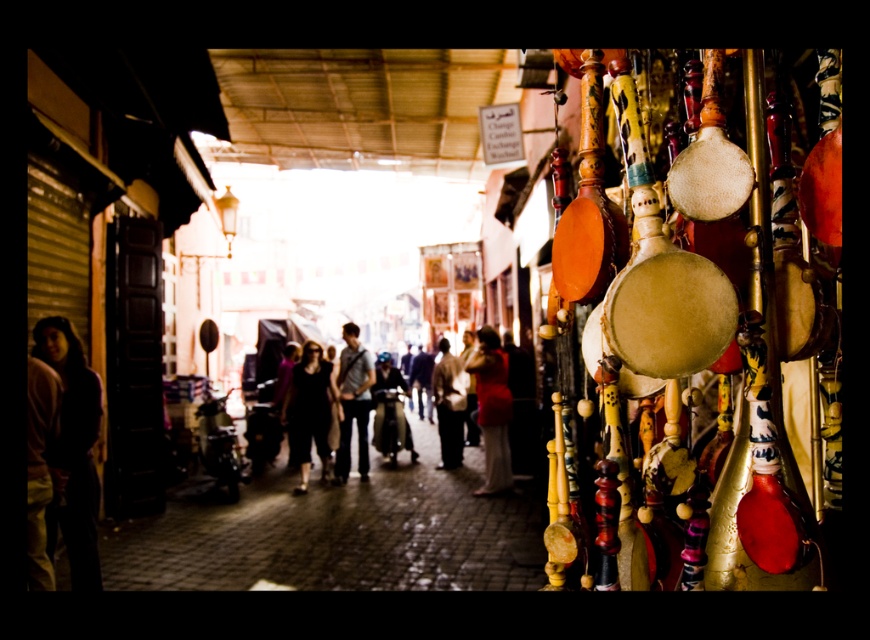
In the scene shown: Does matte red blouse at center have a larger size compared to dark matte clothing at center?

Indeed, matte red blouse at center has a larger size compared to dark matte clothing at center.

Can you confirm if matte red blouse at center is wider than dark matte clothing at center?

Incorrect, matte red blouse at center's width does not surpass dark matte clothing at center's.

Where is `matte red blouse at center`? matte red blouse at center is located at coordinates (492, 410).

Can you confirm if matte black scooter at center is positioned below dark clothing at center?

Yes.

Does point (380, 547) come closer to viewer compared to point (506, 461)?

Yes, it is.

Identify the location of matte black scooter at center. This screenshot has height=640, width=870. (338, 532).

Does dark gray jeans at center have a larger size compared to dark blue leather jacket at center?

Actually, dark gray jeans at center might be smaller than dark blue leather jacket at center.

Who is lower down, dark gray jeans at center or dark blue leather jacket at center?

dark gray jeans at center is lower down.

Between point (359, 406) and point (405, 390), which one is positioned in front?

Point (359, 406)

Locate an element on the screen. This screenshot has height=640, width=870. dark gray jeans at center is located at coordinates (353, 401).